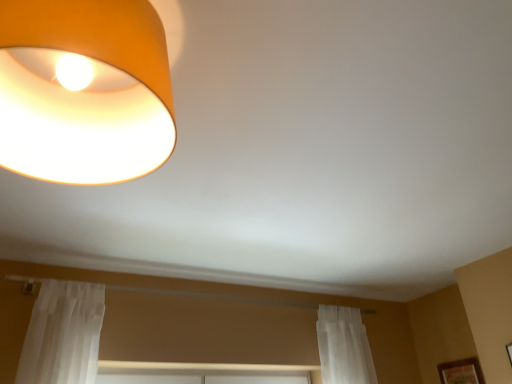
Question: Can you confirm if matte orange lampshade at upper left is shorter than wooden framed picture at lower right?

Choices:
 (A) yes
 (B) no

Answer: (A)

Question: From a real-world perspective, does matte orange lampshade at upper left sit lower than wooden framed picture at lower right?

Choices:
 (A) yes
 (B) no

Answer: (B)

Question: Is matte orange lampshade at upper left outside wooden framed picture at lower right?

Choices:
 (A) no
 (B) yes

Answer: (B)

Question: Is matte orange lampshade at upper left bigger than wooden framed picture at lower right?

Choices:
 (A) no
 (B) yes

Answer: (B)

Question: Are matte orange lampshade at upper left and wooden framed picture at lower right located far from each other?

Choices:
 (A) no
 (B) yes

Answer: (B)

Question: Is matte orange lampshade at upper left closer to camera compared to wooden framed picture at lower right?

Choices:
 (A) yes
 (B) no

Answer: (A)

Question: From the image's perspective, would you say wooden framed picture at lower right is shown under matte orange lampshade at upper left?

Choices:
 (A) yes
 (B) no

Answer: (A)

Question: Considering the relative sizes of wooden framed picture at lower right and matte orange lampshade at upper left in the image provided, is wooden framed picture at lower right shorter than matte orange lampshade at upper left?

Choices:
 (A) no
 (B) yes

Answer: (A)

Question: Is matte orange lampshade at upper left completely or partially inside wooden framed picture at lower right?

Choices:
 (A) yes
 (B) no

Answer: (B)

Question: Can you confirm if wooden framed picture at lower right is wider than matte orange lampshade at upper left?

Choices:
 (A) yes
 (B) no

Answer: (B)

Question: Does wooden framed picture at lower right have a greater height compared to matte orange lampshade at upper left?

Choices:
 (A) yes
 (B) no

Answer: (A)

Question: Is the position of wooden framed picture at lower right more distant than that of matte orange lampshade at upper left?

Choices:
 (A) no
 (B) yes

Answer: (B)

Question: From the image's perspective, is matte orange lampshade at upper left above or below wooden framed picture at lower right?

Choices:
 (A) below
 (B) above

Answer: (B)